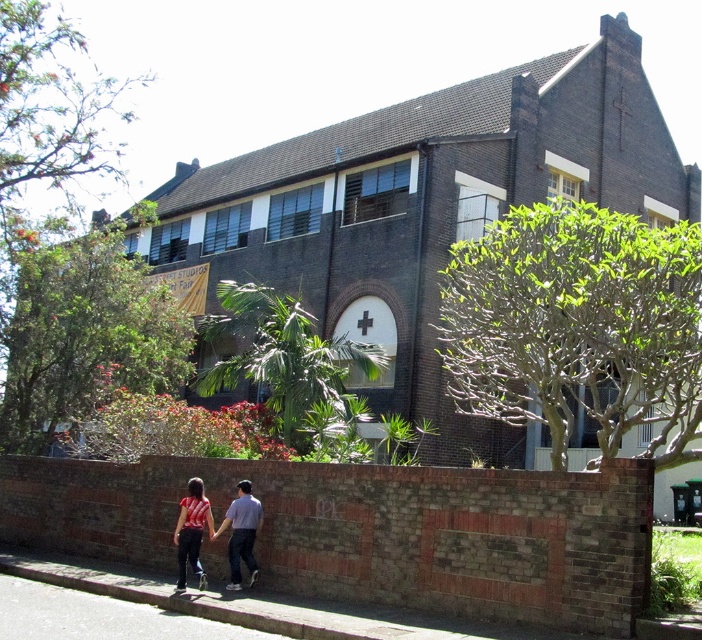
Can you confirm if matte red shirt at lower center is positioned below striped fabric shirt at lower center?

No.

Looking at this image, between matte red shirt at lower center and striped fabric shirt at lower center, which one is positioned higher?

Positioned higher is matte red shirt at lower center.

Does point (187, 524) come closer to viewer compared to point (211, 522)?

Yes.

Find the location of a particular element. The height and width of the screenshot is (640, 702). matte red shirt at lower center is located at coordinates (216, 531).